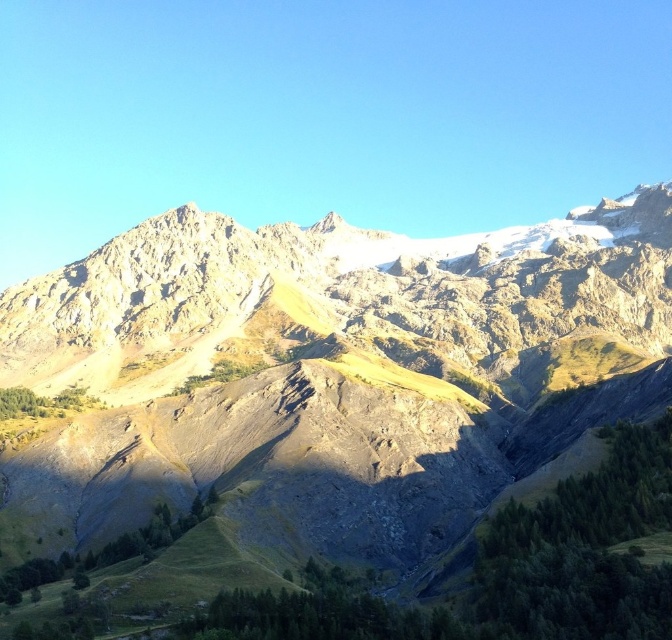
You are standing in the valley and looking towards the mountains. Which mountain is positioned to the right side of the other? The rugged stone mountain at center or the rugged stone mountain range at upper center?

The rugged stone mountain at center is positioned to the left of rugged stone mountain range at upper center, so the rugged stone mountain range at upper center is to the right of rugged stone mountain at center.